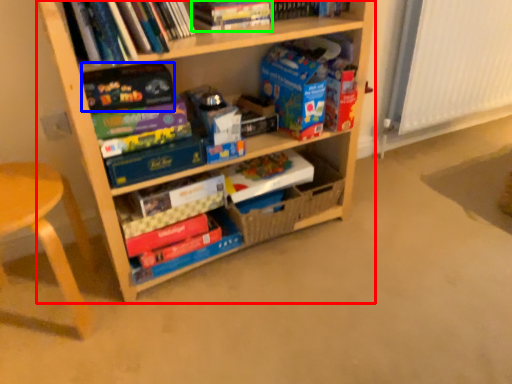
Question: Which object is the farthest from shelf (highlighted by a red box)? Choose among these: paperback book (highlighted by a blue box) or book (highlighted by a green box).

Choices:
 (A) paperback book
 (B) book

Answer: (B)